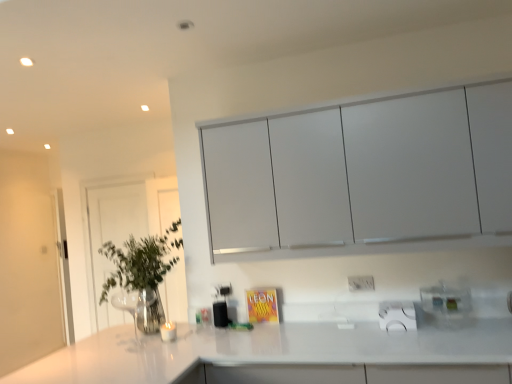
Question: Considering the positions of clear glass door at left and clear glass vase at left in the image, is clear glass door at left bigger or smaller than clear glass vase at left?

Choices:
 (A) big
 (B) small

Answer: (B)

Question: Is clear glass door at left taller or shorter than clear glass vase at left?

Choices:
 (A) short
 (B) tall

Answer: (B)

Question: Based on their relative distances, which object is farther from the white matte cabinet at upper center?

Choices:
 (A) clear glass door at left
 (B) white glossy countertop at center
 (C) white plastic electric outlet at center
 (D) clear plastic spice rack at lower right
 (E) clear glass vase at left

Answer: (A)

Question: Based on their relative distances, which object is farther from the white matte cabinet at upper center?

Choices:
 (A) white plastic electric outlet at center
 (B) clear glass vase at left
 (C) clear plastic spice rack at lower right
 (D) white glossy countertop at center
 (E) clear glass door at left

Answer: (E)